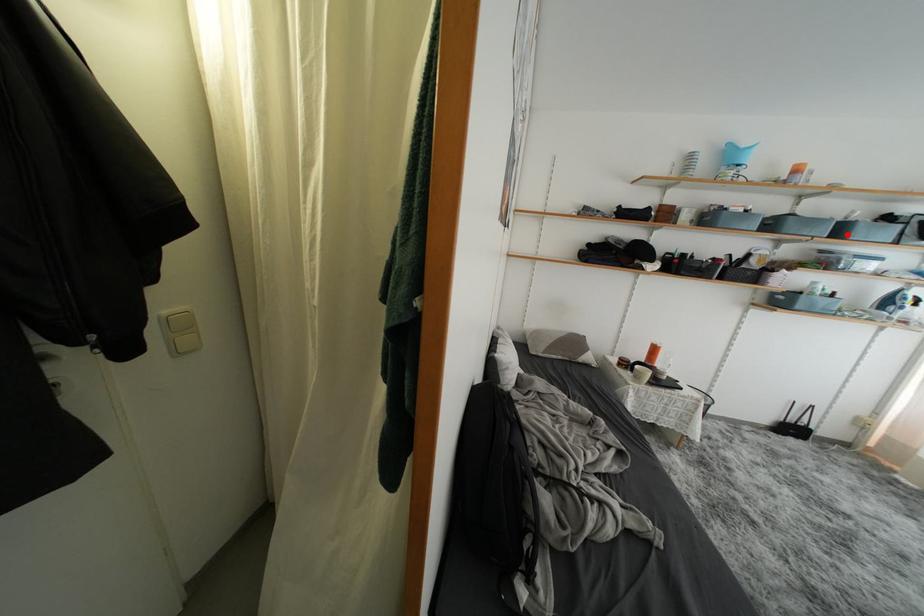
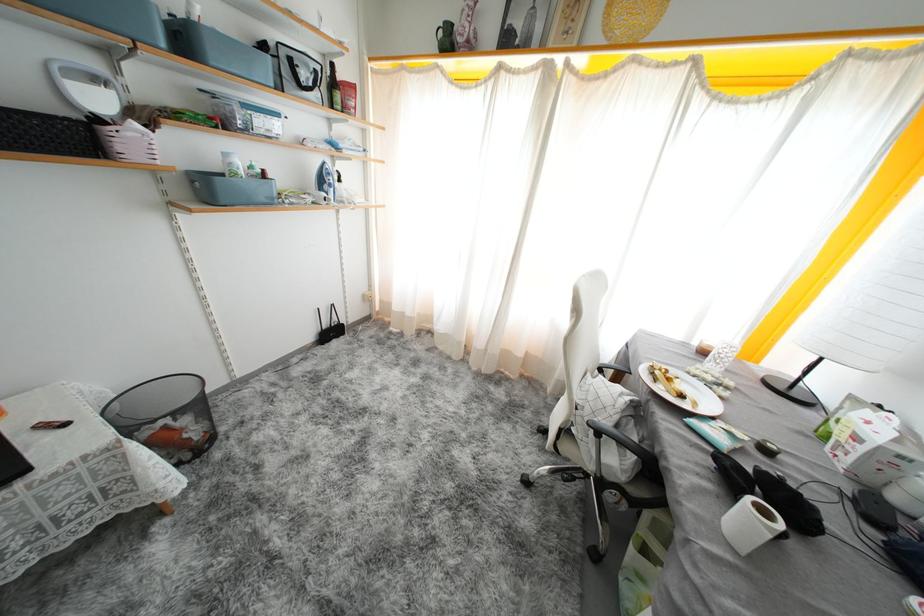
Locate, in the second image, the point that corresponds to the highlighted location in the first image.

(190, 44)